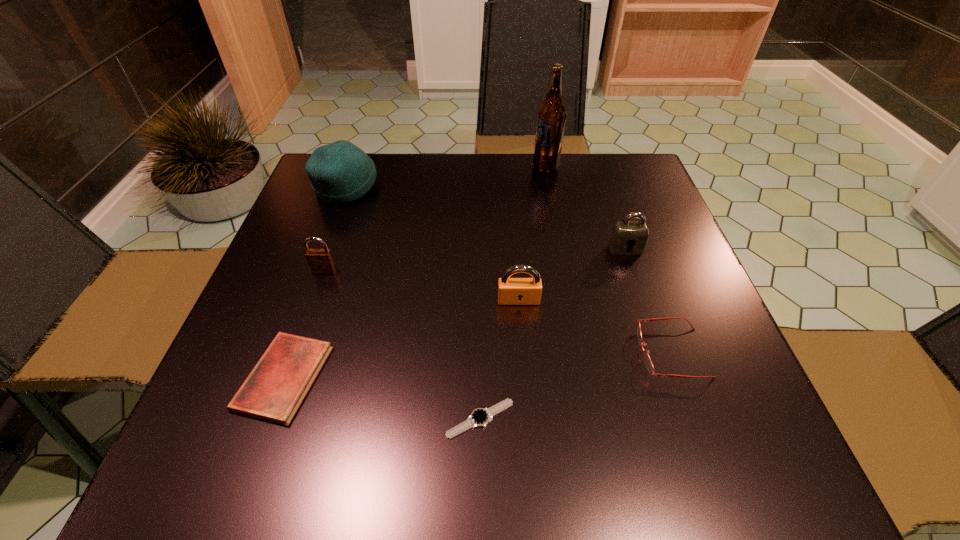
This screenshot has width=960, height=540. I want to click on the tallest object, so click(551, 116).

At what (x,y) coordinates should I click in order to perform the action: click on the third object from right to left. Please return your answer as a coordinate pair (x, y). The width and height of the screenshot is (960, 540). Looking at the image, I should click on (551, 116).

At what (x,y) coordinates should I click in order to perform the action: click on the seventh shortest object. Please return your answer as a coordinate pair (x, y). This screenshot has width=960, height=540. Looking at the image, I should click on (340, 172).

Image resolution: width=960 pixels, height=540 pixels. I want to click on the sixth nearest object, so click(625, 234).

Locate an element on the screen. Image resolution: width=960 pixels, height=540 pixels. the farthest padlock is located at coordinates (625, 234).

I want to click on the fourth nearest object, so click(x=511, y=291).

Identify the location of the second padlock from left to right. (511, 291).

You are a GUI agent. You are given a task and a screenshot of the screen. Output one action in this format:
    pyautogui.click(x=<x>, y=<y>)
    Task: Click on the leftmost padlock
    
    Given the screenshot: What is the action you would take?
    pyautogui.click(x=320, y=261)

The height and width of the screenshot is (540, 960). In order to click on the second nearest padlock in this screenshot , I will do `click(320, 261)`.

You are a GUI agent. You are given a task and a screenshot of the screen. Output one action in this format:
    pyautogui.click(x=<x>, y=<y>)
    Task: Click on the spectacles
    The width and height of the screenshot is (960, 540).
    Given the screenshot: What is the action you would take?
    pyautogui.click(x=648, y=362)